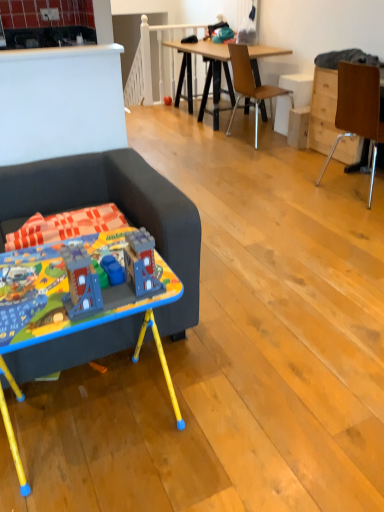
At what (x,y) coordinates should I click in order to perform the action: click on free space in front of brown wooden chair at center, acting as the first chair starting from the left. Please return your answer as a coordinate pair (x, y). The height and width of the screenshot is (512, 384). Looking at the image, I should click on (243, 153).